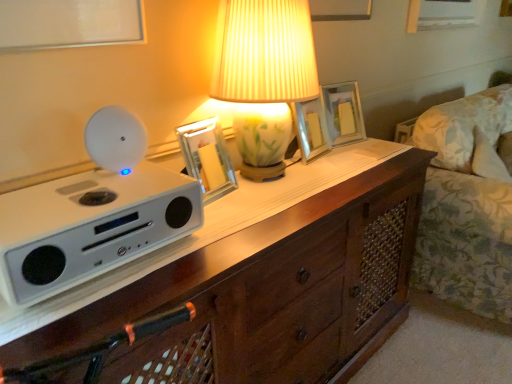
At what (x,y) coordinates should I click in order to perform the action: click on wooden chest of drawers at center. Please return your answer as a coordinate pair (x, y). Looking at the image, I should click on (259, 281).

The height and width of the screenshot is (384, 512). Describe the element at coordinates (259, 281) in the screenshot. I see `wooden chest of drawers at center` at that location.

In order to face white matte speaker at left, should I rotate leftwards or rightwards?

You should rotate left by 22.075 degrees.

The image size is (512, 384). What do you see at coordinates (343, 113) in the screenshot?
I see `matte glass picture frame at center, the 1th picture frame from the right` at bounding box center [343, 113].

Where is `floral fabric couch at right`? The width and height of the screenshot is (512, 384). floral fabric couch at right is located at coordinates (466, 205).

Are floral fabric couch at right and wooden chest of drawers at center located far from each other?

No, there isn't a large distance between floral fabric couch at right and wooden chest of drawers at center.

Is floral fabric couch at right facing away from wooden chest of drawers at center?

No.

Based on the photo, which is closer to the camera, (459,138) or (190,259)?

Point (459,138) appears to be farther away from the viewer than point (190,259).

From the picture: Between floral fabric couch at right and wooden chest of drawers at center, which one appears on the left side from the viewer's perspective?

wooden chest of drawers at center is more to the left.

Between wooden chest of drawers at center and floral fabric couch at right, which one has smaller size?

Smaller between the two is wooden chest of drawers at center.

Considering the positions of objects wooden chest of drawers at center and floral fabric couch at right in the image provided, who is behind, wooden chest of drawers at center or floral fabric couch at right?

floral fabric couch at right is further away from the camera.

Find the location of a particular element. The image size is (512, 384). the chest of drawers located in front of the floral fabric couch at right is located at coordinates (259, 281).

In the scene shown: Which object is wider, wooden chest of drawers at center or floral fabric couch at right?

Wider between the two is floral fabric couch at right.

Is metallic silver picture frame at center, which appears as the second picture frame when viewed from the back, turned away from metallic silver picture frame at center, positioned as the 1th picture frame in front-to-back order?

metallic silver picture frame at center, which appears as the second picture frame when viewed from the back, does not have its back to metallic silver picture frame at center, positioned as the 1th picture frame in front-to-back order.

Which of these two, metallic silver picture frame at center, placed as the 2th picture frame when sorted from left to right, or metallic silver picture frame at center, which is counted as the 1th picture frame, starting from the left, stands shorter?

metallic silver picture frame at center, which is counted as the 1th picture frame, starting from the left.

Is metallic silver picture frame at center, placed as the 2th picture frame when sorted from left to right, smaller than metallic silver picture frame at center, positioned as the 1th picture frame in front-to-back order?

No, metallic silver picture frame at center, placed as the 2th picture frame when sorted from left to right, is not smaller than metallic silver picture frame at center, positioned as the 1th picture frame in front-to-back order.

From the picture: How different are the orientations of metallic silver picture frame at center, which appears as the second picture frame when viewed from the back, and metallic silver picture frame at center, the third picture frame from the right, in degrees?

metallic silver picture frame at center, which appears as the second picture frame when viewed from the back, and metallic silver picture frame at center, the third picture frame from the right, are facing 2.48 degrees away from each other.

From a real-world perspective, who is located lower, white matte speaker at left or metallic silver picture frame at center, placed as the 2th picture frame when sorted from left to right?

white matte speaker at left is physically lower.

Consider the image. Is white matte speaker at left looking in the opposite direction of metallic silver picture frame at center, which is the 2th picture frame from right to left?

No.

From the image's perspective, between white matte speaker at left and metallic silver picture frame at center, which is the 2th picture frame from right to left, which one is located above?

From the image's view, metallic silver picture frame at center, which is the 2th picture frame from right to left, is above.

From their relative heights in the image, would you say white matte speaker at left is taller or shorter than metallic silver picture frame at center, which appears as the second picture frame when viewed from the back?

white matte speaker at left is shorter than metallic silver picture frame at center, which appears as the second picture frame when viewed from the back.

Considering the relative positions of wooden chest of drawers at center and matte glass picture frame at center, which appears as the third picture frame when viewed from the left, in the image provided, is wooden chest of drawers at center in front of matte glass picture frame at center, which appears as the third picture frame when viewed from the left,?

Yes, wooden chest of drawers at center is closer to the camera.

Who is smaller, wooden chest of drawers at center or matte glass picture frame at center, which appears as the third picture frame when viewed from the left?

With smaller size is matte glass picture frame at center, which appears as the third picture frame when viewed from the left.

From the wooden chest of drawers at center, count 3rd picture frames backward and point to it. Please provide its 2D coordinates.

[(343, 113)]

Between wooden chest of drawers at center and matte glass picture frame at center, which appears as the third picture frame when viewed from the left, which one has larger width?

Wider between the two is wooden chest of drawers at center.

What's the angular difference between white matte speaker at left and matte glass picture frame at center, which appears as the 1th picture frame when viewed from the back,'s facing directions?

The angular difference between white matte speaker at left and matte glass picture frame at center, which appears as the 1th picture frame when viewed from the back, is 14.1 degrees.

Which point is more distant from viewer, (136, 129) or (354, 101)?

Positioned behind is point (354, 101).

Does white matte speaker at left have a larger size compared to matte glass picture frame at center, which appears as the 1th picture frame when viewed from the back?

Yes, white matte speaker at left is bigger than matte glass picture frame at center, which appears as the 1th picture frame when viewed from the back.

Which of these two, white matte speaker at left or matte glass picture frame at center, the 1th picture frame from the right, stands shorter?

white matte speaker at left is shorter.

At what (x,y) coordinates should I click in order to perform the action: click on the 1st picture frame behind the metallic silver picture frame at center, the third picture frame from the right, starting your count from the anchor. Please return your answer as a coordinate pair (x, y). The image size is (512, 384). Looking at the image, I should click on (311, 128).

Which is behind, point (189, 133) or point (311, 134)?

Positioned behind is point (311, 134).

Is metallic silver picture frame at center, which is counted as the 1th picture frame, starting from the left, turned away from metallic silver picture frame at center, which is the 2th picture frame from right to left?

No, metallic silver picture frame at center, which is counted as the 1th picture frame, starting from the left, is not facing the opposite direction of metallic silver picture frame at center, which is the 2th picture frame from right to left.

From the image's perspective, is metallic silver picture frame at center, positioned as the 1th picture frame in front-to-back order, located beneath metallic silver picture frame at center, which appears as the second picture frame when viewed from the back?

Indeed, from the image's perspective, metallic silver picture frame at center, positioned as the 1th picture frame in front-to-back order, is shown beneath metallic silver picture frame at center, which appears as the second picture frame when viewed from the back.

I want to click on couch that appears on the right of wooden chest of drawers at center, so click(x=466, y=205).

Image resolution: width=512 pixels, height=384 pixels. In the image, there is a wooden chest of drawers at center. In order to click on couch above it (from the image's perspective) in this screenshot , I will do `click(466, 205)`.

From the image, which object appears to be farther from matte glass picture frame at center, which appears as the 1th picture frame when viewed from the back, floral fabric couch at right or metallic silver picture frame at center, the third picture frame from the right?

metallic silver picture frame at center, the third picture frame from the right, is positioned further to the anchor matte glass picture frame at center, which appears as the 1th picture frame when viewed from the back.

Based on their spatial positions, is wooden chest of drawers at center or matte glass picture frame at center, which appears as the 3th picture frame when viewed from the front, further from metallic silver picture frame at center, placed as the 2th picture frame when sorted from left to right?

Among the two, wooden chest of drawers at center is located further to metallic silver picture frame at center, placed as the 2th picture frame when sorted from left to right.

Considering their positions, is metallic silver picture frame at center, positioned as the 1th picture frame in front-to-back order, positioned closer to wooden chest of drawers at center than porcelain floral lamp at center?

metallic silver picture frame at center, positioned as the 1th picture frame in front-to-back order.

Considering their positions, is porcelain floral lamp at center positioned closer to wooden chest of drawers at center than floral fabric couch at right?

porcelain floral lamp at center.

Estimate the real-world distances between objects in this image. Which object is further from white matte speaker at left, metallic silver picture frame at center, placed as the 2th picture frame when sorted from left to right, or wooden chest of drawers at center?

metallic silver picture frame at center, placed as the 2th picture frame when sorted from left to right.

Looking at the image, which one is located closer to floral fabric couch at right, matte glass picture frame at center, the 1th picture frame from the right, or white matte speaker at left?

The object closer to floral fabric couch at right is matte glass picture frame at center, the 1th picture frame from the right.

Which object lies nearer to the anchor point metallic silver picture frame at center, positioned as the 1th picture frame in front-to-back order, porcelain floral lamp at center or matte glass picture frame at center, which appears as the third picture frame when viewed from the left?

Based on the image, porcelain floral lamp at center appears to be nearer to metallic silver picture frame at center, positioned as the 1th picture frame in front-to-back order.

Based on the photo, estimate the real-world distances between objects in this image. Which object is closer to matte glass picture frame at center, which appears as the third picture frame when viewed from the left, porcelain floral lamp at center or floral fabric couch at right?

porcelain floral lamp at center is closer to matte glass picture frame at center, which appears as the third picture frame when viewed from the left.

This screenshot has height=384, width=512. Identify the location of lamp between wooden chest of drawers at center and metallic silver picture frame at center, acting as the second picture frame starting from the front, in the front-back direction. (263, 76).

Find the location of a particular element. The width and height of the screenshot is (512, 384). lamp between metallic silver picture frame at center, which is counted as the 1th picture frame, starting from the left, and floral fabric couch at right from left to right is located at coordinates (263, 76).

Locate an element on the screen. This screenshot has width=512, height=384. lamp between white matte speaker at left and floral fabric couch at right in the horizontal direction is located at coordinates (263, 76).

The width and height of the screenshot is (512, 384). I want to click on picture frame between porcelain floral lamp at center and metallic silver picture frame at center, which appears as the second picture frame when viewed from the back, from front to back, so click(x=207, y=158).